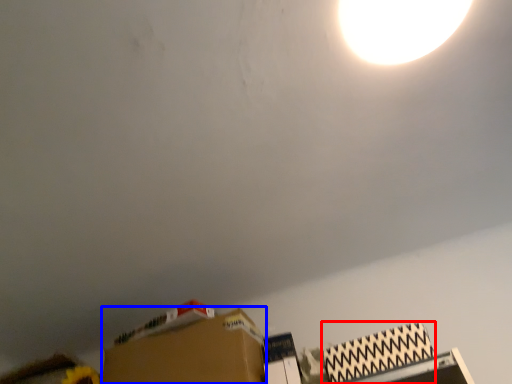
Question: Which object is closer to the camera taking this photo, cardboard box (highlighted by a red box) or cardboard box (highlighted by a blue box)?

Choices:
 (A) cardboard box
 (B) cardboard box

Answer: (A)